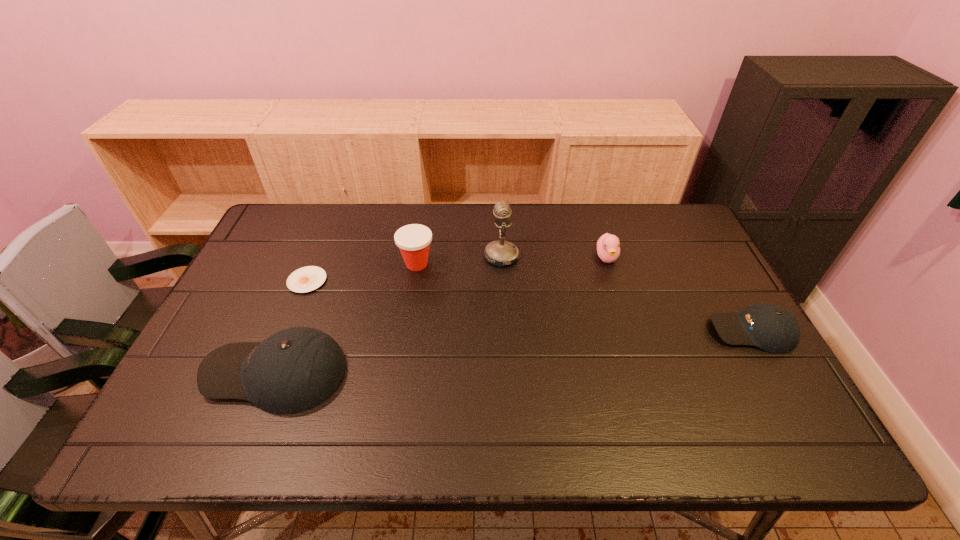
You are a GUI agent. You are given a task and a screenshot of the screen. Output one action in this format:
    pyautogui.click(x=<x>, y=<y>)
    Task: Click on the microphone present at the far edge
    This screenshot has width=960, height=540.
    Given the screenshot: What is the action you would take?
    pyautogui.click(x=499, y=253)

What are the coordinates of `object that is positioned at the near edge` in the screenshot? It's located at (296, 369).

Identify the location of baseball cap positioned at the left edge. The width and height of the screenshot is (960, 540). (296, 369).

Image resolution: width=960 pixels, height=540 pixels. I want to click on egg yolk situated at the left edge, so click(306, 279).

Image resolution: width=960 pixels, height=540 pixels. Identify the location of object situated at the right edge. (770, 327).

Find the location of `object situated at the near left corner`. object situated at the near left corner is located at coordinates (296, 369).

Identify the location of vacant region at the far edge of the desktop. (354, 226).

You are a GUI agent. You are given a task and a screenshot of the screen. Output one action in this format:
    pyautogui.click(x=<x>, y=<y>)
    Task: Click on the free space at the near edge of the desktop
    
    Given the screenshot: What is the action you would take?
    pyautogui.click(x=394, y=397)

Image resolution: width=960 pixels, height=540 pixels. Identify the location of vacant space at the left edge of the desktop. (261, 261).

The height and width of the screenshot is (540, 960). What are the coordinates of `vacant space at the right edge of the desktop` in the screenshot? It's located at (691, 278).